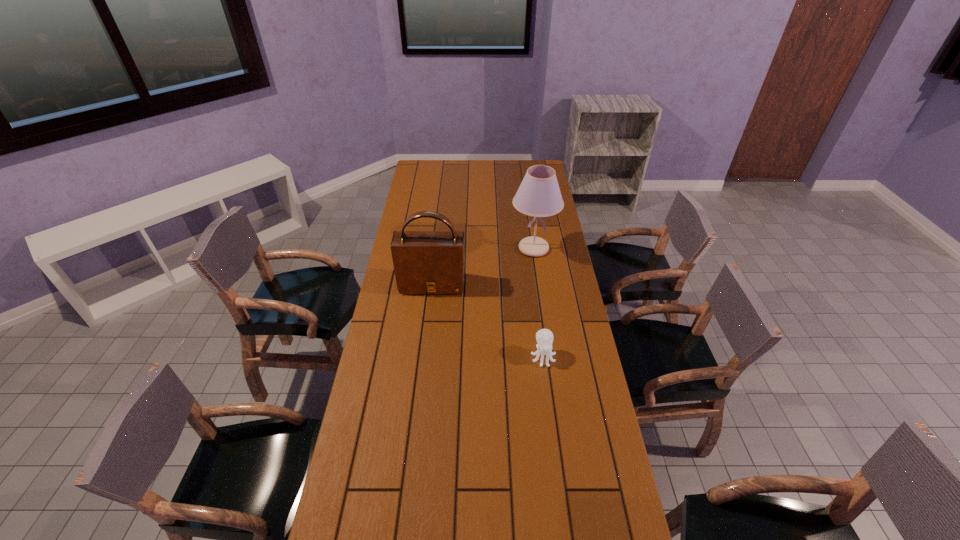
Image resolution: width=960 pixels, height=540 pixels. In order to click on octopus located in the right edge section of the desktop in this screenshot , I will do `click(544, 337)`.

This screenshot has height=540, width=960. In the image, there is a desktop. Find the location of `vacant space at the left edge`. vacant space at the left edge is located at coordinates (396, 300).

I want to click on free spot at the right edge of the desktop, so point(526,218).

In the image, there is a desktop. Where is `vacant space at the far right corner`? The height and width of the screenshot is (540, 960). vacant space at the far right corner is located at coordinates (545, 162).

The height and width of the screenshot is (540, 960). Find the location of `free space that is in between the nearest object and the lampshade`. free space that is in between the nearest object and the lampshade is located at coordinates (539, 302).

The width and height of the screenshot is (960, 540). What are the coordinates of `vacant point located between the nearest object and the shoulder bag` in the screenshot? It's located at click(488, 320).

Identify the location of free spot between the farthest object and the octopus. (539, 302).

The image size is (960, 540). I want to click on object that is the closest to the octopus, so click(425, 262).

You are a GUI agent. You are given a task and a screenshot of the screen. Output one action in this format:
    pyautogui.click(x=<x>, y=<y>)
    Task: Click on the object that is the closest to the shortest object
    The image size is (960, 540).
    Given the screenshot: What is the action you would take?
    pyautogui.click(x=425, y=262)